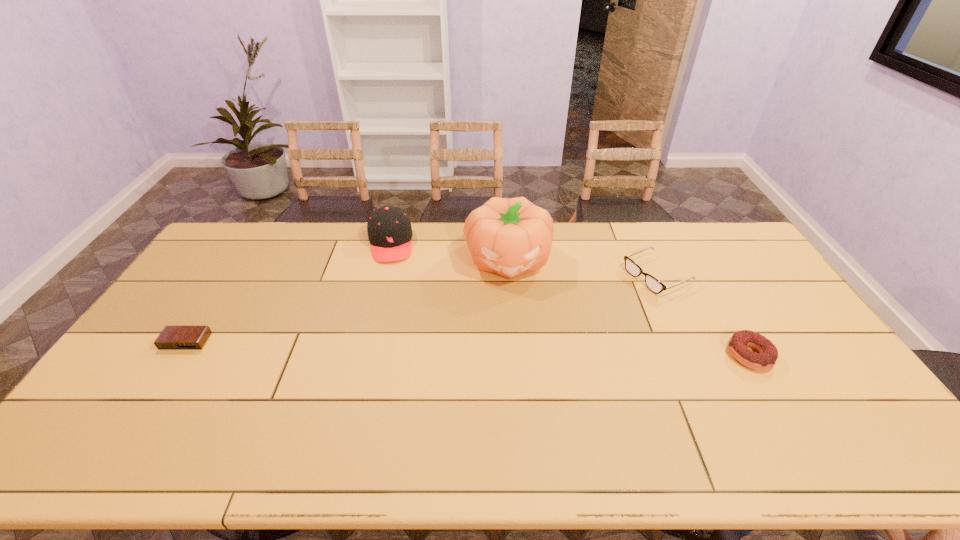
At what (x,y) coordinates should I click in order to perform the action: click on unoccupied position between the doughnut and the tallest object. Please return your answer as a coordinate pair (x, y). This screenshot has width=960, height=540. Looking at the image, I should click on (629, 307).

The height and width of the screenshot is (540, 960). What are the coordinates of `empty location between the doughnut and the leftmost object` in the screenshot? It's located at (468, 348).

Where is `vacant space that is in between the spectacles and the doughnut`? This screenshot has height=540, width=960. vacant space that is in between the spectacles and the doughnut is located at coordinates (703, 315).

Where is `vacant space that's between the fourth shortest object and the doughnut`? vacant space that's between the fourth shortest object and the doughnut is located at coordinates (569, 299).

Find the location of `free spot between the leftmost object and the spectacles`. free spot between the leftmost object and the spectacles is located at coordinates click(x=421, y=308).

Where is `vacant space in between the alarm clock and the spectacles`? vacant space in between the alarm clock and the spectacles is located at coordinates (421, 308).

Where is `unoccupied area between the spectacles and the tallest object`? This screenshot has width=960, height=540. unoccupied area between the spectacles and the tallest object is located at coordinates (583, 267).

This screenshot has width=960, height=540. In order to click on free space between the pumpkin and the alarm clock in this screenshot , I will do `click(347, 300)`.

This screenshot has width=960, height=540. I want to click on vacant point located between the alarm clock and the doughnut, so click(468, 348).

At what (x,y) coordinates should I click in order to perform the action: click on free spot between the shortest object and the second object from left to right. Please return your answer as a coordinate pair (x, y). Looking at the image, I should click on pyautogui.click(x=288, y=292).